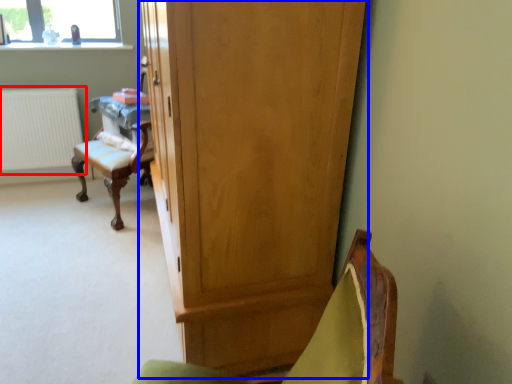
Question: Which point is further to the camera, radiator (highlighted by a red box) or cupboard (highlighted by a blue box)?

Choices:
 (A) radiator
 (B) cupboard

Answer: (A)